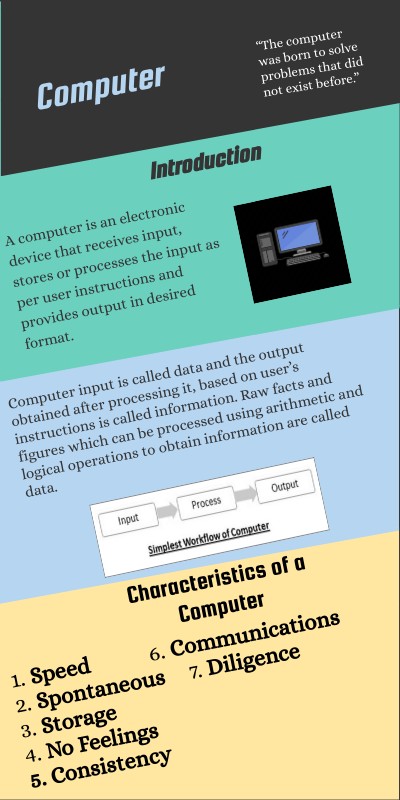
You are a GUI agent. You are given a task and a screenshot of the screen. Output one action in this format:
    pyautogui.click(x=<x>, y=<y>)
    Task: Click on the mouse
    Image resolution: width=400 pixels, height=800 pixels.
    Given the screenshot: What is the action you would take?
    pyautogui.click(x=325, y=254)